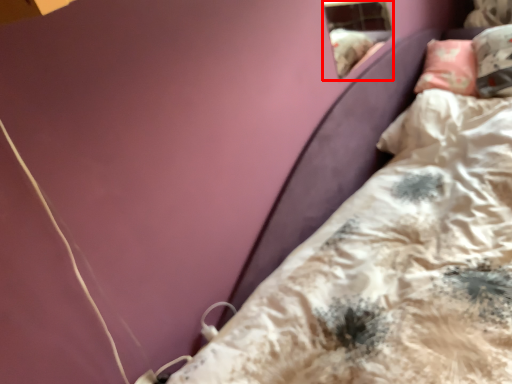
Question: Observing the image, what is the correct spatial positioning of window (annotated by the red box) in reference to bed?

Choices:
 (A) left
 (B) right

Answer: (A)